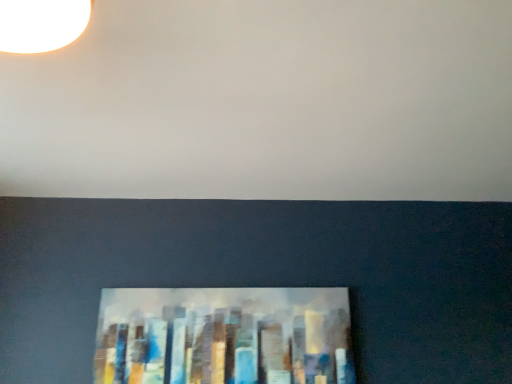
Question: Considering the positions of point (329, 142) and point (121, 370), is point (329, 142) closer or farther from the camera than point (121, 370)?

Choices:
 (A) farther
 (B) closer

Answer: (B)

Question: From the image's perspective, is white matte wall at upper center above or below metallic abstract painting at lower center?

Choices:
 (A) above
 (B) below

Answer: (A)

Question: Looking at their shapes, would you say white matte wall at upper center is wider or thinner than metallic abstract painting at lower center?

Choices:
 (A) wide
 (B) thin

Answer: (A)

Question: From the image's perspective, is metallic abstract painting at lower center positioned above or below white matte wall at upper center?

Choices:
 (A) below
 (B) above

Answer: (A)

Question: From their relative heights in the image, would you say metallic abstract painting at lower center is taller or shorter than white matte wall at upper center?

Choices:
 (A) short
 (B) tall

Answer: (B)

Question: Considering the relative positions of metallic abstract painting at lower center and white matte wall at upper center in the image provided, is metallic abstract painting at lower center to the left or to the right of white matte wall at upper center?

Choices:
 (A) left
 (B) right

Answer: (A)

Question: Choose the correct answer: Is metallic abstract painting at lower center inside white matte wall at upper center or outside it?

Choices:
 (A) inside
 (B) outside

Answer: (B)